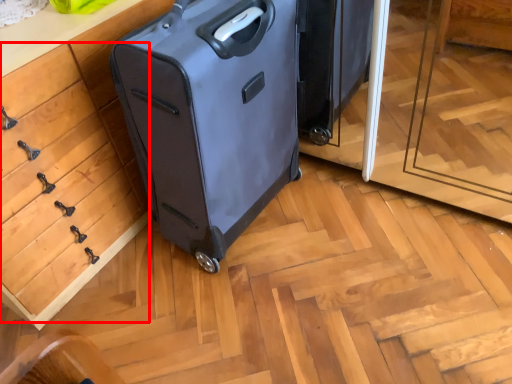
Question: Observing the image, what is the correct spatial positioning of drawer (annotated by the red box) in reference to suitcase?

Choices:
 (A) left
 (B) right

Answer: (A)